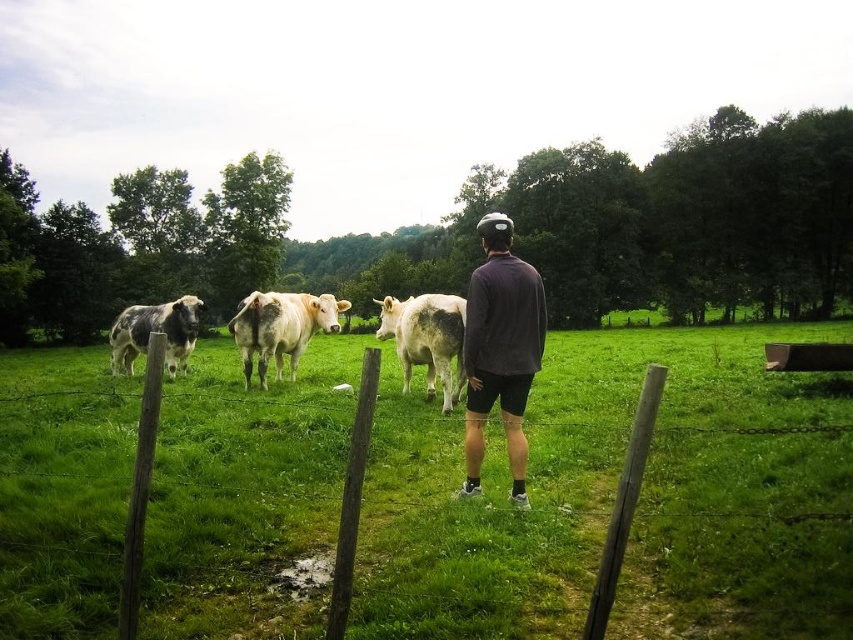
You are a farmer checking the field. You need to determine which area is larger between the green grassy field at center and the white smooth cow at center. Which one is larger?

The green grassy field at center is bigger than the white smooth cow at center, so the green grassy field at center is larger.